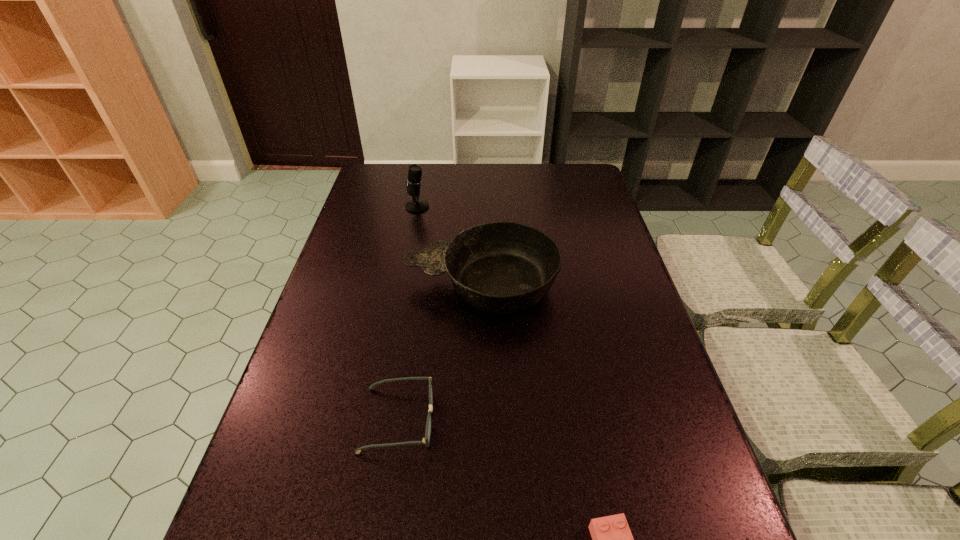
Locate an element on the screen. vacant space situated on the face of the second shortest object is located at coordinates (570, 420).

The image size is (960, 540). In order to click on free space at the far edge of the desktop in this screenshot , I will do `click(534, 187)`.

The width and height of the screenshot is (960, 540). What are the coordinates of `free space at the left edge of the desktop` in the screenshot? It's located at point(331,362).

Locate an element on the screen. This screenshot has height=540, width=960. free spot at the right edge of the desktop is located at coordinates (610, 236).

I want to click on vacant space at the far left corner of the desktop, so click(371, 169).

Locate an element on the screen. Image resolution: width=960 pixels, height=540 pixels. free space at the far right corner is located at coordinates (591, 169).

Locate an element on the screen. The image size is (960, 540). unoccupied position between the second farthest object and the spectacles is located at coordinates (440, 352).

This screenshot has width=960, height=540. I want to click on free space between the tallest object and the spectacles, so click(x=408, y=313).

This screenshot has width=960, height=540. Identify the location of vacant space that is in between the second shortest object and the farthest object. (408, 313).

Image resolution: width=960 pixels, height=540 pixels. I want to click on unoccupied position between the spectacles and the microphone, so click(408, 313).